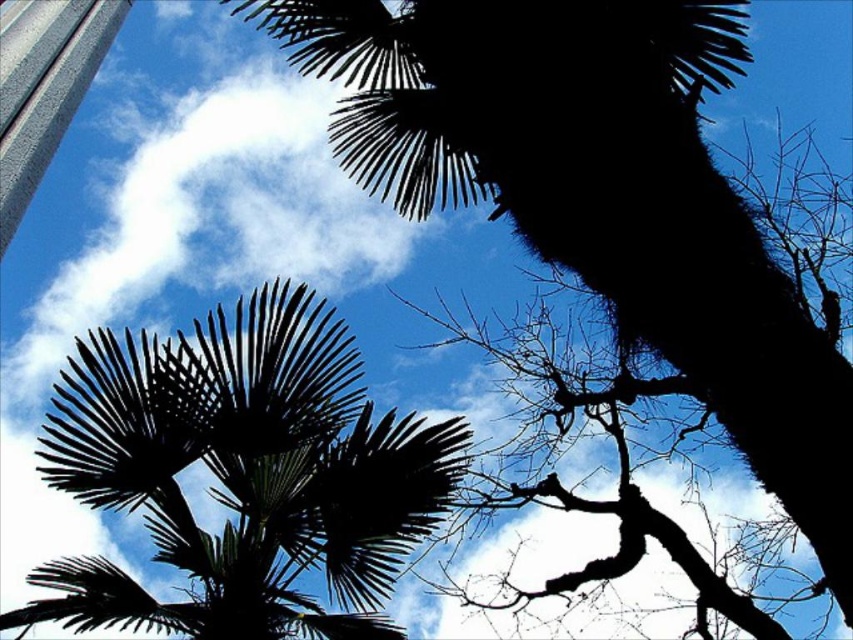
Looking at this image, you are an artist trying to sketch the tree branches in the image. You want to place the silhouette leafy branch at upper center accurately. According to the coordinates provided, where should you position it on your canvas?

The silhouette leafy branch at upper center should be positioned at coordinates point (602, 196) on the canvas.

You are an artist sketching the scene from below, looking up at the trees. You want to ensure the silhouette leafy branch at upper center and the dark green leafy palm tree at center are proportionally accurate. Which object should you draw smaller?

The silhouette leafy branch at upper center should be drawn smaller because it occupies less space than the dark green leafy palm tree at center.